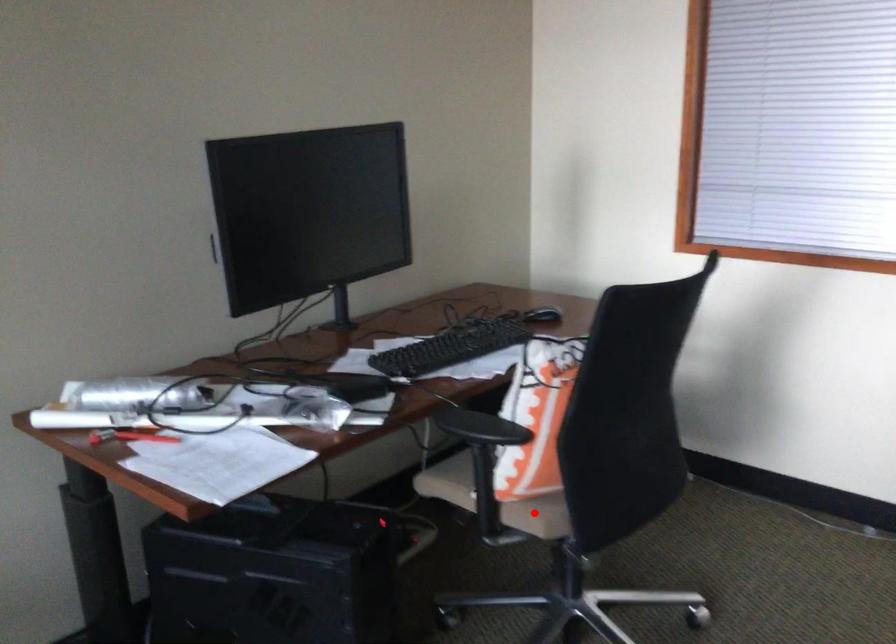
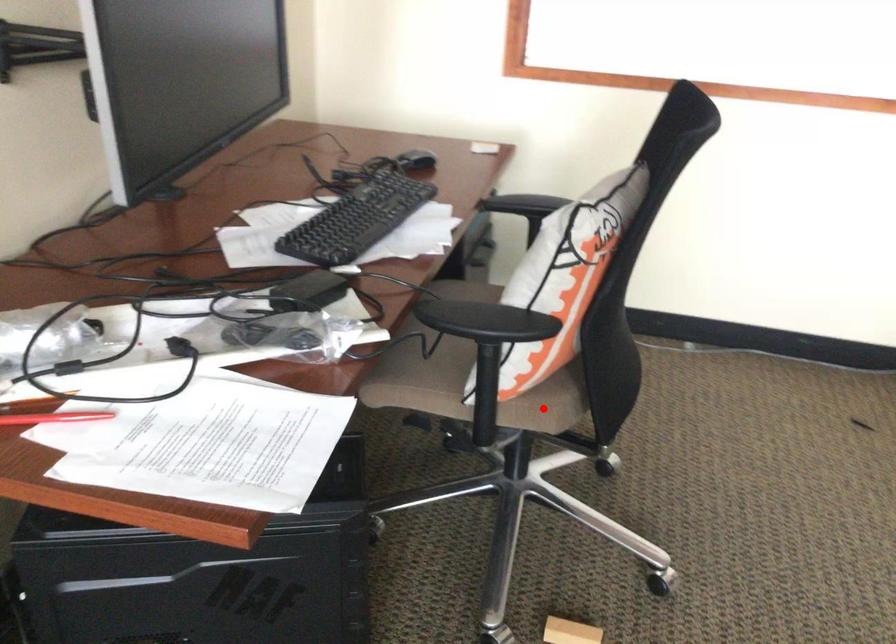
I am providing you with two images of the same scene from different viewpoints. A red point is marked on the first image and another point is marked on the second image. Do the highlighted points in image1 and image2 indicate the same real-world spot?

Yes